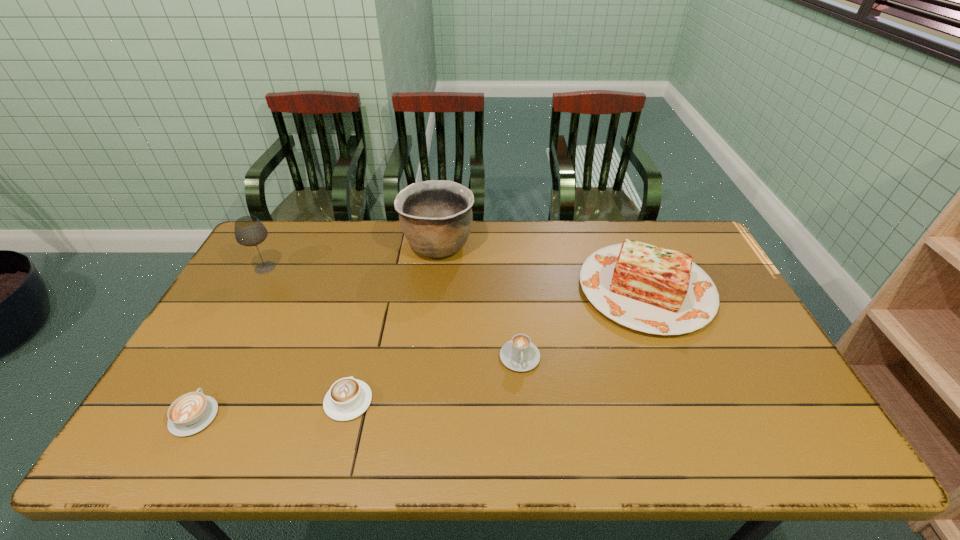
The width and height of the screenshot is (960, 540). In order to click on pottery that is at the far edge in this screenshot , I will do `click(436, 217)`.

I want to click on wineglass that is at the far edge, so click(x=249, y=231).

Image resolution: width=960 pixels, height=540 pixels. I want to click on lasagna that is positioned at the far edge, so click(647, 288).

What are the coordinates of `object that is at the near edge` in the screenshot? It's located at (190, 413).

You are a GUI agent. You are given a task and a screenshot of the screen. Output one action in this format:
    pyautogui.click(x=<x>, y=<y>)
    Task: Click on the wineglass present at the left edge
    
    Given the screenshot: What is the action you would take?
    pyautogui.click(x=249, y=231)

This screenshot has height=540, width=960. In order to click on cappuccino positioned at the left edge in this screenshot , I will do `click(190, 413)`.

Locate an element on the screen. The image size is (960, 540). object that is at the right edge is located at coordinates (647, 288).

The image size is (960, 540). In order to click on object situated at the far left corner in this screenshot , I will do point(249,231).

You are a GUI agent. You are given a task and a screenshot of the screen. Output one action in this format:
    pyautogui.click(x=<x>, y=<y>)
    Task: Click on the object situated at the near left corner
    
    Given the screenshot: What is the action you would take?
    pyautogui.click(x=190, y=413)

Identify the location of object that is at the far right corner. The height and width of the screenshot is (540, 960). (647, 288).